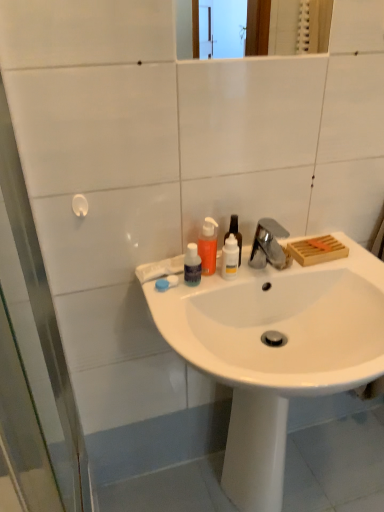
Question: Considering the relative sizes of transparent plastic bottle at center, the fourth bottle positioned from the left, and satin nickel faucet at upper center in the image provided, is transparent plastic bottle at center, the fourth bottle positioned from the left, wider than satin nickel faucet at upper center?

Choices:
 (A) yes
 (B) no

Answer: (B)

Question: Considering the relative sizes of transparent plastic bottle at center, the fourth bottle positioned from the left, and satin nickel faucet at upper center in the image provided, is transparent plastic bottle at center, the fourth bottle positioned from the left, shorter than satin nickel faucet at upper center?

Choices:
 (A) yes
 (B) no

Answer: (B)

Question: Does transparent plastic bottle at center, the fourth bottle positioned from the left, touch satin nickel faucet at upper center?

Choices:
 (A) yes
 (B) no

Answer: (A)

Question: Can you confirm if transparent plastic bottle at center, placed as the 1th bottle when sorted from right to left, is taller than satin nickel faucet at upper center?

Choices:
 (A) no
 (B) yes

Answer: (B)

Question: Considering the relative sizes of transparent plastic bottle at center, placed as the 1th bottle when sorted from right to left, and satin nickel faucet at upper center in the image provided, is transparent plastic bottle at center, placed as the 1th bottle when sorted from right to left, bigger than satin nickel faucet at upper center?

Choices:
 (A) no
 (B) yes

Answer: (B)

Question: Considering their positions, is translucent plastic bottle at center, acting as the 3th bottle starting from the left, located in front of or behind white plastic hook at left?

Choices:
 (A) behind
 (B) front

Answer: (A)

Question: In terms of width, does translucent plastic bottle at center, acting as the 3th bottle starting from the left, look wider or thinner when compared to white plastic hook at left?

Choices:
 (A) wide
 (B) thin

Answer: (B)

Question: Choose the correct answer: Is translucent plastic bottle at center, which is the 2th bottle from right to left, inside white plastic hook at left or outside it?

Choices:
 (A) inside
 (B) outside

Answer: (B)

Question: From their relative heights in the image, would you say translucent plastic bottle at center, which is the 2th bottle from right to left, is taller or shorter than white plastic hook at left?

Choices:
 (A) tall
 (B) short

Answer: (B)

Question: From the image's perspective, is transparent plastic bottle at center, arranged as the 1th bottle when viewed from the left, positioned above or below satin nickel faucet at upper center?

Choices:
 (A) above
 (B) below

Answer: (B)

Question: Considering the positions of point (195, 282) and point (271, 264), is point (195, 282) closer or farther from the camera than point (271, 264)?

Choices:
 (A) closer
 (B) farther

Answer: (A)

Question: Would you say transparent plastic bottle at center, arranged as the 1th bottle when viewed from the left, is to the left or to the right of satin nickel faucet at upper center in the picture?

Choices:
 (A) left
 (B) right

Answer: (A)

Question: Looking at the image, does transparent plastic bottle at center, which is the fourth bottle in right-to-left order, seem bigger or smaller compared to satin nickel faucet at upper center?

Choices:
 (A) small
 (B) big

Answer: (B)

Question: From the image's perspective, is satin nickel faucet at upper center above or below translucent plastic bottle at center, which is the 2th bottle from right to left?

Choices:
 (A) below
 (B) above

Answer: (B)

Question: Is satin nickel faucet at upper center inside or outside of translucent plastic bottle at center, acting as the 3th bottle starting from the left?

Choices:
 (A) inside
 (B) outside

Answer: (B)